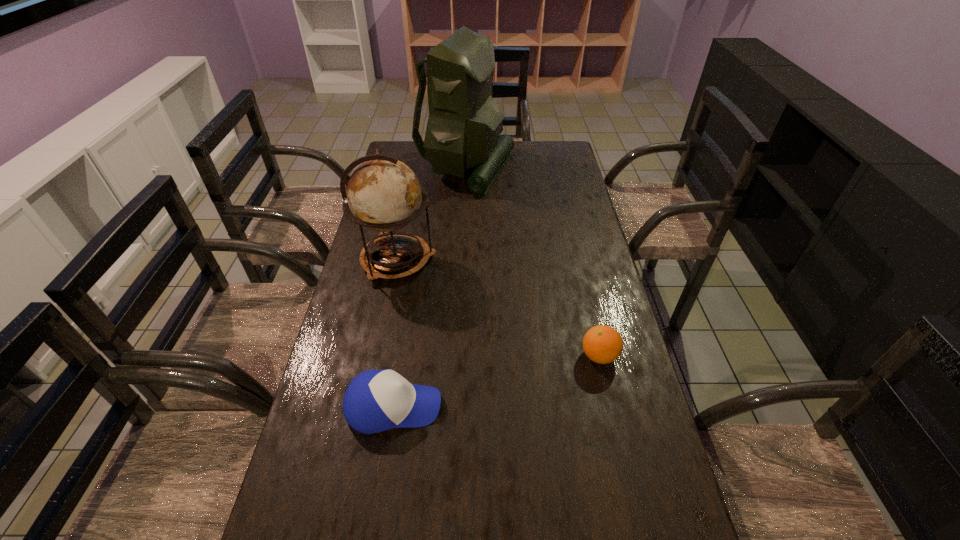
I want to click on free spot located on the left of the third farthest object, so click(474, 356).

Where is `object located in the far edge section of the desktop`? Image resolution: width=960 pixels, height=540 pixels. object located in the far edge section of the desktop is located at coordinates (464, 123).

Locate an element on the screen. Image resolution: width=960 pixels, height=540 pixels. backpack that is at the left edge is located at coordinates (464, 123).

Identify the location of globe that is at the left edge. (384, 194).

I want to click on baseball cap situated at the left edge, so click(x=375, y=400).

Locate an element on the screen. object situated at the right edge is located at coordinates (602, 344).

You are a GUI agent. You are given a task and a screenshot of the screen. Output one action in this format:
    pyautogui.click(x=<x>, y=<y>)
    Task: Click on the object that is at the far left corner
    This screenshot has width=960, height=540.
    Given the screenshot: What is the action you would take?
    pyautogui.click(x=464, y=123)

Where is `free region at the far edge of the desktop`? The image size is (960, 540). free region at the far edge of the desktop is located at coordinates (527, 148).

In the image, there is a desktop. Where is `vacant area at the left edge`? The height and width of the screenshot is (540, 960). vacant area at the left edge is located at coordinates (352, 302).

Identify the location of vacant space at the right edge of the desktop. (573, 207).